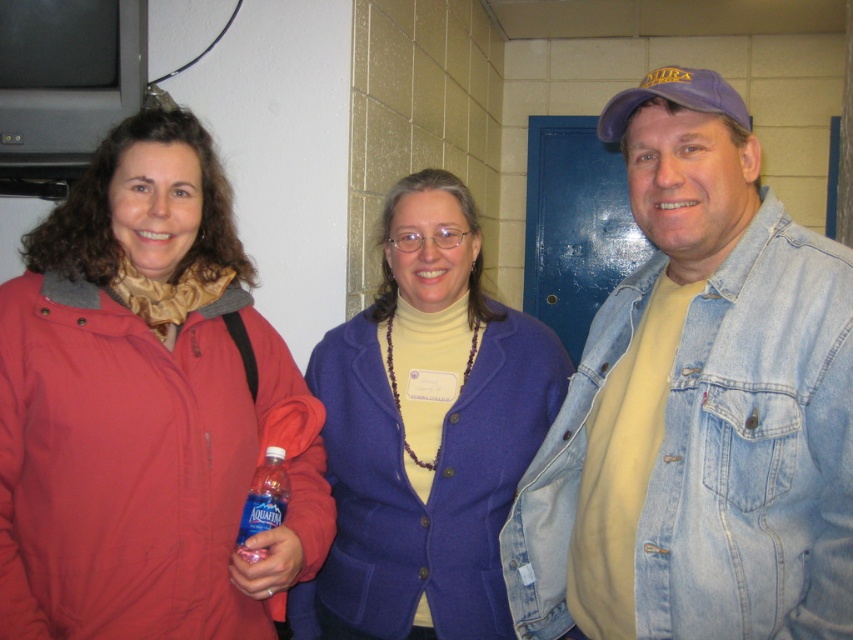
Does denim jacket at right have a larger size compared to matte purple blazer at center?

No.

Is denim jacket at right smaller than matte purple blazer at center?

Indeed, denim jacket at right has a smaller size compared to matte purple blazer at center.

Identify the location of denim jacket at right. (697, 406).

Does denim jacket at right have a larger size compared to purple fabric baseball cap at right?

Correct, denim jacket at right is larger in size than purple fabric baseball cap at right.

Locate an element on the screen. The width and height of the screenshot is (853, 640). denim jacket at right is located at coordinates (697, 406).

Is denim jacket at right behind clear plastic bottle at center?

No, denim jacket at right is closer to the viewer.

Is denim jacket at right in front of clear plastic bottle at center?

Yes, it is in front of clear plastic bottle at center.

Does point (846, 404) come in front of point (273, 504)?

Yes, point (846, 404) is in front of point (273, 504).

I want to click on denim jacket at right, so click(x=697, y=406).